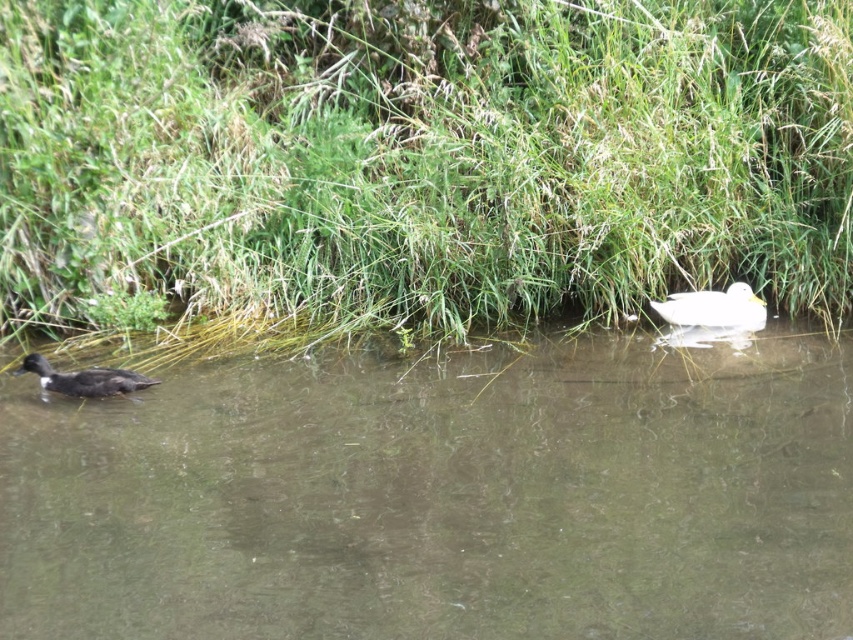
Does brown murky water at lower left appear under dark brown feathers at lower left?

Correct, brown murky water at lower left is located below dark brown feathers at lower left.

Who is more forward, [653,524] or [91,396]?

Point [653,524] is more forward.

Is point (637, 483) behind point (24, 364)?

No, it is not.

This screenshot has width=853, height=640. I want to click on brown murky water at lower left, so click(x=440, y=497).

Which is in front, point (508, 106) or point (805, 598)?

Positioned in front is point (805, 598).

Can you confirm if green grass at center is thinner than brown murky water at lower left?

Yes.

Is point (444, 321) more distant than point (596, 448)?

Yes, it is behind point (596, 448).

The height and width of the screenshot is (640, 853). Identify the location of green grass at center. (422, 156).

Between brown murky water at lower left and white matte duck at upper center, which one has less height?

white matte duck at upper center is shorter.

Does brown murky water at lower left have a smaller size compared to white matte duck at upper center?

Incorrect, brown murky water at lower left is not smaller in size than white matte duck at upper center.

At what (x,y) coordinates should I click in order to perform the action: click on brown murky water at lower left. Please return your answer as a coordinate pair (x, y). Looking at the image, I should click on (440, 497).